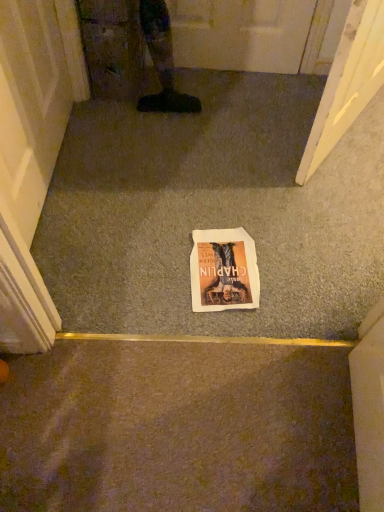
Locate an element on the screen. The width and height of the screenshot is (384, 512). vacant space situated above white paper at center (from a real-world perspective) is located at coordinates (216, 167).